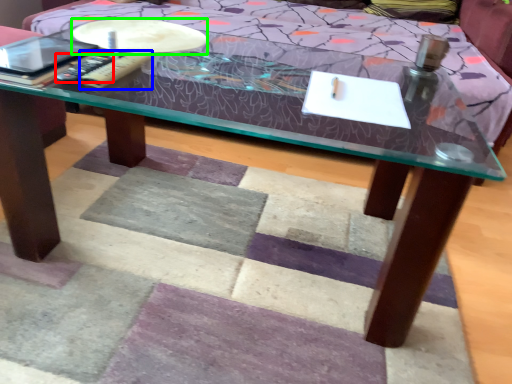
Question: Which object is positioned closest to remote (highlighted by a red box)? Select from remote (highlighted by a blue box) and round table (highlighted by a green box).

Choices:
 (A) remote
 (B) round table

Answer: (A)